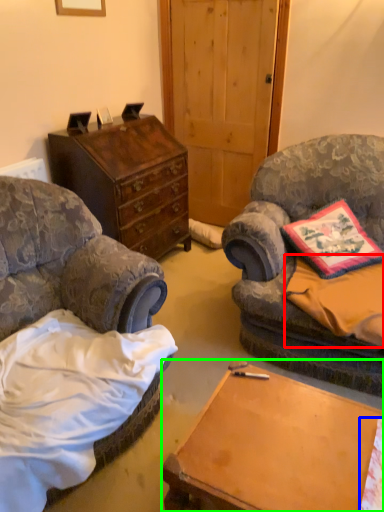
Question: Estimate the real-world distances between objects in this image. Which object is closer to sheet (highlighted by a red box), sheet (highlighted by a blue box) or desk (highlighted by a green box)?

Choices:
 (A) sheet
 (B) desk

Answer: (B)